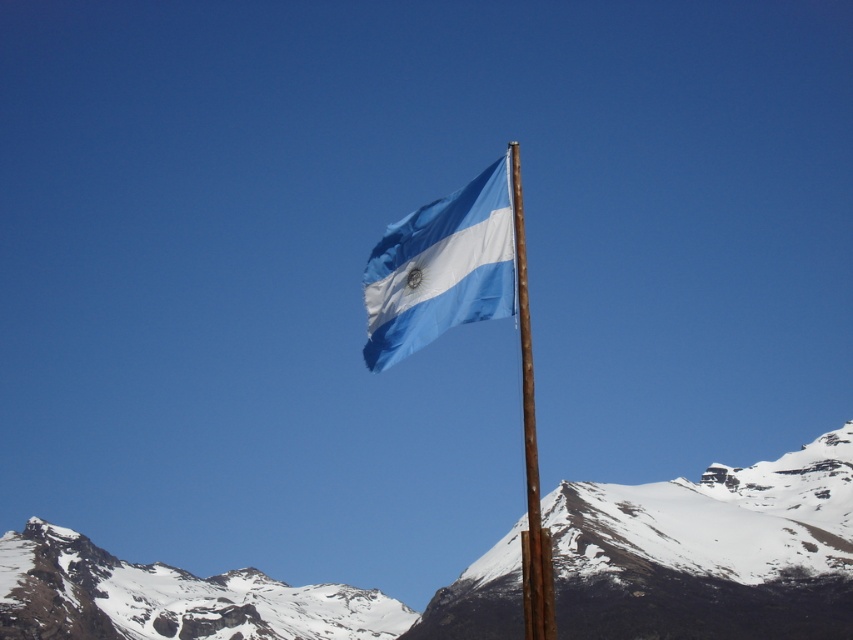
Question: Which point is farther from the camera taking this photo?

Choices:
 (A) (485, 218)
 (B) (33, 618)

Answer: (B)

Question: Which of the following is the closest to the observer?

Choices:
 (A) snowy rock at center
 (B) rusty wood flag pole at center
 (C) blue fabric flag at center

Answer: (B)

Question: Which object is the farthest from the snowy rock at center?

Choices:
 (A) blue fabric flag at center
 (B) rusty wood flag pole at center
 (C) snowy rock at lower left

Answer: (A)

Question: Is snowy rock at center to the right of blue fabric flag at center from the viewer's perspective?

Choices:
 (A) no
 (B) yes

Answer: (A)

Question: Is snowy rock at center thinner than blue fabric flag at center?

Choices:
 (A) no
 (B) yes

Answer: (A)

Question: Can you confirm if snowy rock at center is positioned to the right of blue fabric flag at center?

Choices:
 (A) yes
 (B) no

Answer: (B)